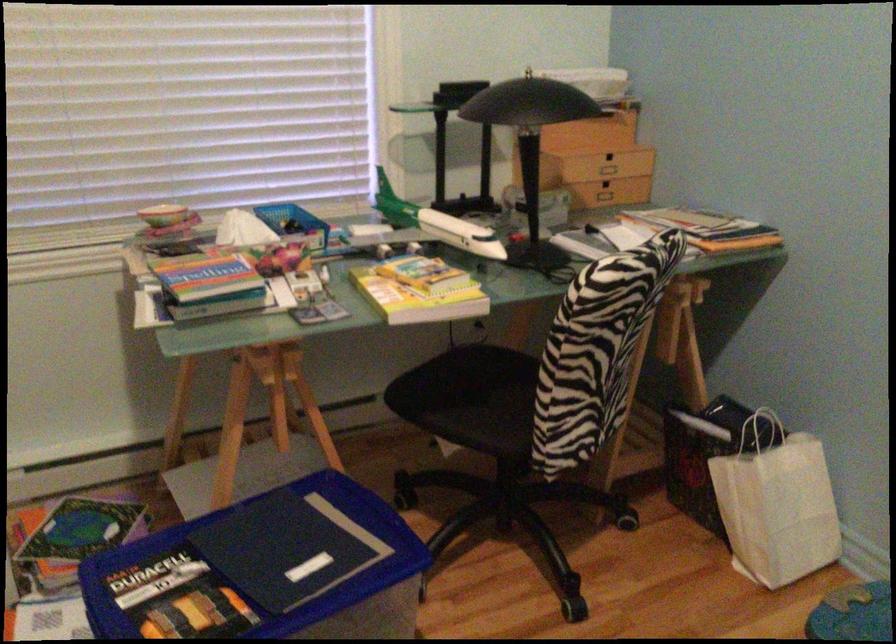
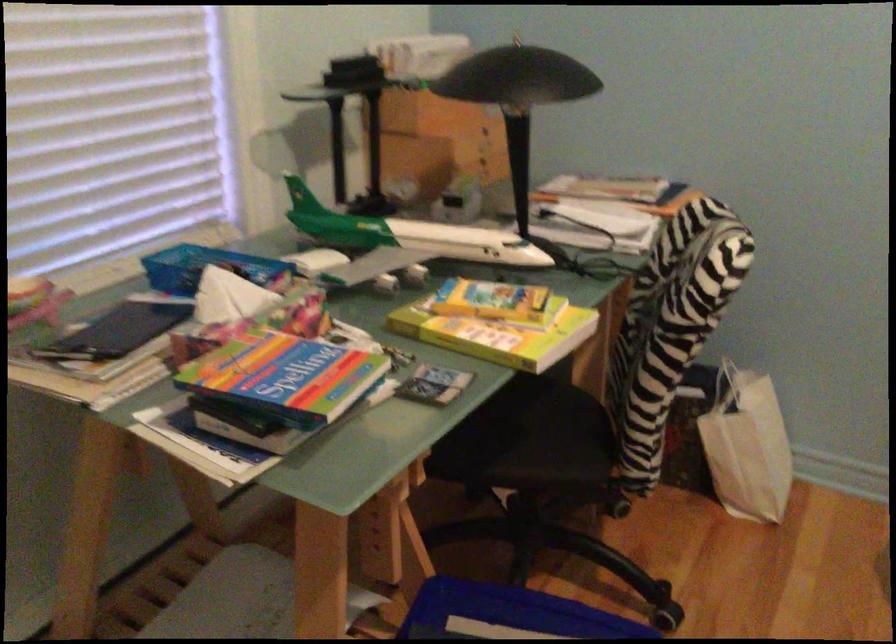
Locate, in the second image, the point that corresponds to (x=743, y=494) in the first image.

(746, 446)